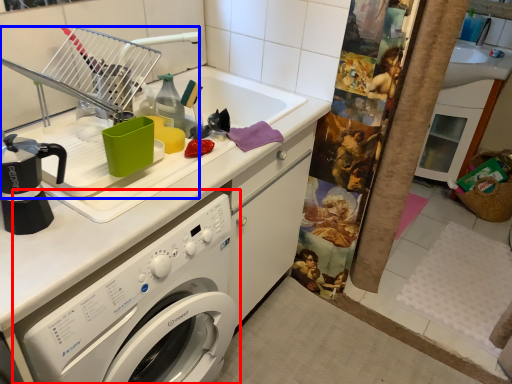
Question: Which of the following is the closest to the observer, washing machine (highlighted by a red box) or appliance (highlighted by a blue box)?

Choices:
 (A) washing machine
 (B) appliance

Answer: (A)